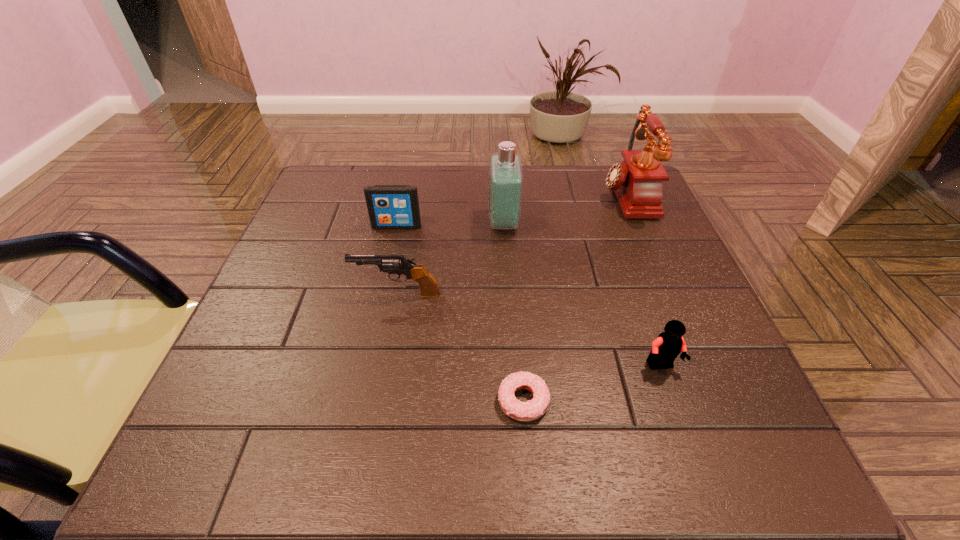
You are a GUI agent. You are given a task and a screenshot of the screen. Output one action in this format:
    pyautogui.click(x=<x>, y=<y>)
    Task: Click on the perfume at the far edge
    
    Given the screenshot: What is the action you would take?
    pyautogui.click(x=505, y=173)

I want to click on object present at the near edge, so click(x=533, y=409).

At what (x,y) coordinates should I click in order to perform the action: click on telephone that is at the right edge. Please return your answer as a coordinate pair (x, y). Looking at the image, I should click on (637, 182).

Find the location of `Lego that is at the right edge`. Lego that is at the right edge is located at coordinates (666, 347).

Where is `object present at the far right corner`? object present at the far right corner is located at coordinates click(x=637, y=182).

Find the location of a particular element. The image size is (960, 540). vacant area at the far edge is located at coordinates (486, 190).

The width and height of the screenshot is (960, 540). I want to click on free spot at the near edge of the desktop, so click(395, 466).

At what (x,y) coordinates should I click in order to perform the action: click on vacant area at the left edge of the desktop. Please return your answer as a coordinate pair (x, y). The width and height of the screenshot is (960, 540). Looking at the image, I should click on (242, 343).

In the image, there is a desktop. Where is `vacant space at the right edge`? vacant space at the right edge is located at coordinates (645, 345).

In the image, there is a desktop. Where is `vacant space at the far left corner`? This screenshot has height=540, width=960. vacant space at the far left corner is located at coordinates (306, 202).